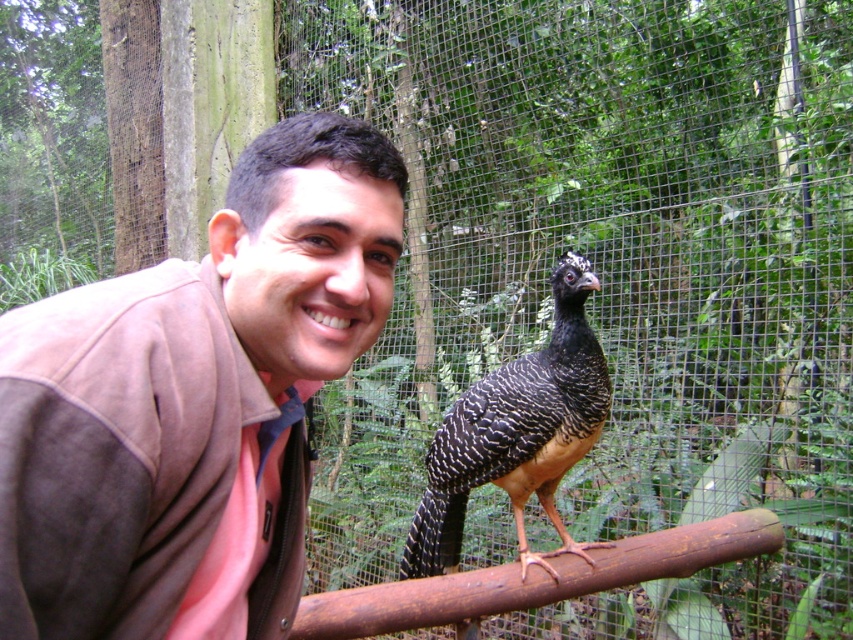
Question: Can you confirm if brown suede jacket at upper left is wider than rusty metal rail at center?

Choices:
 (A) no
 (B) yes

Answer: (A)

Question: Which of the following is the farthest from the observer?

Choices:
 (A) black glossy bird at center
 (B) rusty metal rail at center
 (C) brown suede jacket at upper left

Answer: (A)

Question: Is brown suede jacket at upper left further to camera compared to rusty metal rail at center?

Choices:
 (A) no
 (B) yes

Answer: (A)

Question: Which point is farther from the camera taking this photo?

Choices:
 (A) (125, 579)
 (B) (527, 579)

Answer: (B)

Question: Which point appears farthest from the camera in this image?

Choices:
 (A) (410, 524)
 (B) (650, 566)

Answer: (A)

Question: Does black glossy bird at center have a smaller size compared to rusty metal rail at center?

Choices:
 (A) yes
 (B) no

Answer: (B)